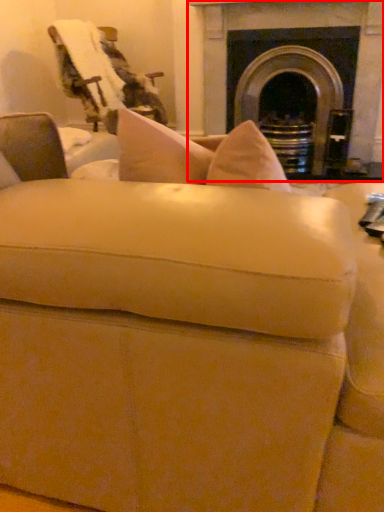
Question: Considering the relative positions of fireplace (annotated by the red box) and swivel chair in the image provided, where is fireplace (annotated by the red box) located with respect to the staircase?

Choices:
 (A) left
 (B) right

Answer: (B)